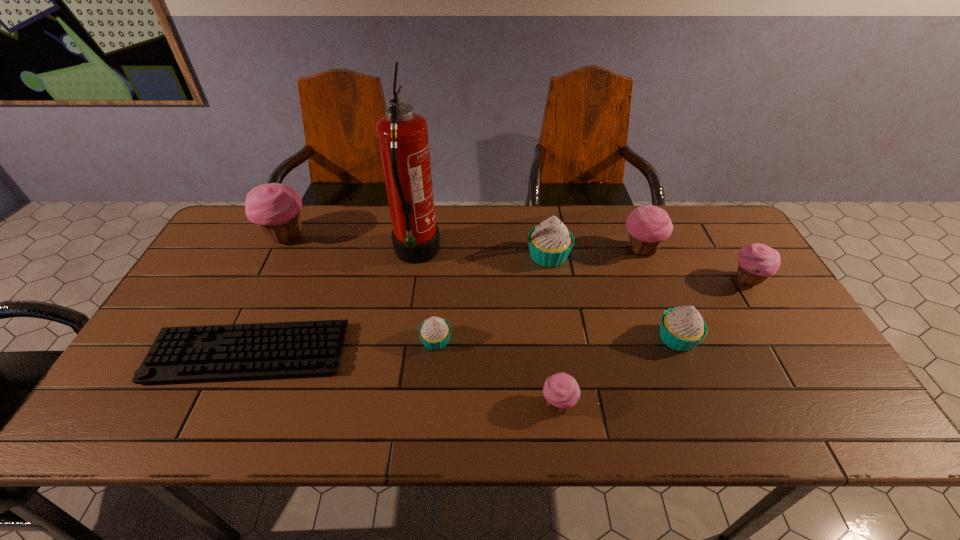
Locate an element on the screen. The height and width of the screenshot is (540, 960). pink cupcake that stands as the fourth closest to the rightmost white cupcake is located at coordinates (275, 207).

Locate which white cupcake is the closest to the farthest white cupcake. Please provide its 2D coordinates. Your answer should be formatted as a tuple, i.e. [(x, y)], where the tuple contains the x and y coordinates of a point satisfying the conditions above.

[(682, 328)]

Choose which white cupcake is the second nearest neighbor to the tallest cupcake. Please provide its 2D coordinates. Your answer should be formatted as a tuple, i.e. [(x, y)], where the tuple contains the x and y coordinates of a point satisfying the conditions above.

[(550, 243)]

Find the location of a particular element. This screenshot has width=960, height=540. free space that satisfies the following two spatial constraints: 1. on the front-facing side of the nearest object; 2. on the left side of the fire extinguisher is located at coordinates (394, 404).

Find the location of `vacant area in the image that satisfies the following two spatial constraints: 1. on the back side of the computer keyboard; 2. on the right side of the third smallest pink cupcake`. vacant area in the image that satisfies the following two spatial constraints: 1. on the back side of the computer keyboard; 2. on the right side of the third smallest pink cupcake is located at coordinates (296, 249).

Locate an element on the screen. This screenshot has width=960, height=540. free point that satisfies the following two spatial constraints: 1. on the front-facing side of the red fire extinguisher; 2. on the right side of the rightmost object is located at coordinates (413, 280).